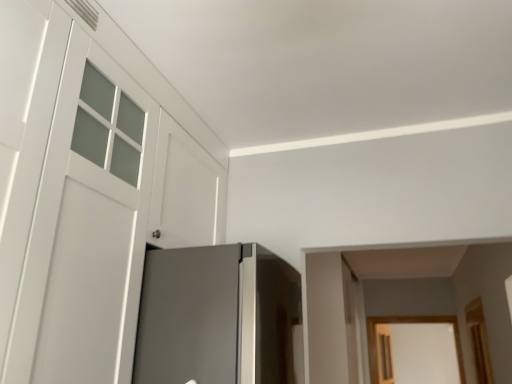
The image size is (512, 384). What do you see at coordinates (384, 354) in the screenshot?
I see `clear glass screen door at lower right` at bounding box center [384, 354].

Where is `clear glass screen door at lower right`? Image resolution: width=512 pixels, height=384 pixels. clear glass screen door at lower right is located at coordinates (384, 354).

What is the approximate height of clear glass screen door at lower right?

The height of clear glass screen door at lower right is 78.65 centimeters.

The image size is (512, 384). Describe the element at coordinates (89, 189) in the screenshot. I see `white matte door at left` at that location.

What are the coordinates of `white matte door at left` in the screenshot? It's located at (89, 189).

Where is `clear glass screen door at lower right`? The width and height of the screenshot is (512, 384). clear glass screen door at lower right is located at coordinates (384, 354).

Between clear glass screen door at lower right and white matte door at left, which one appears on the right side from the viewer's perspective?

Positioned to the right is clear glass screen door at lower right.

Is clear glass screen door at lower right in front of or behind white matte door at left in the image?

In the image, clear glass screen door at lower right appears behind white matte door at left.

Considering the positions of points (382, 366) and (66, 367), is point (382, 366) farther from camera compared to point (66, 367)?

Yes, point (382, 366) is farther from viewer.

From the image's perspective, does clear glass screen door at lower right appear lower than white matte door at left?

Yes, from the image's perspective, clear glass screen door at lower right is beneath white matte door at left.

Consider the image. From a real-world perspective, who is located lower, clear glass screen door at lower right or white matte door at left?

From a 3D spatial view, clear glass screen door at lower right is below.

Does clear glass screen door at lower right have a lesser width compared to white matte door at left?

Yes, clear glass screen door at lower right is thinner than white matte door at left.

In terms of height, does clear glass screen door at lower right look taller or shorter compared to white matte door at left?

clear glass screen door at lower right is shorter than white matte door at left.

Considering the relative sizes of clear glass screen door at lower right and white matte door at left in the image provided, is clear glass screen door at lower right bigger than white matte door at left?

Actually, clear glass screen door at lower right might be smaller than white matte door at left.

Is clear glass screen door at lower right inside the boundaries of white matte door at left, or outside?

The correct answer is: outside.

Is clear glass screen door at lower right beside white matte door at left?

clear glass screen door at lower right and white matte door at left are not in contact.

Does clear glass screen door at lower right turn towards white matte door at left?

No, clear glass screen door at lower right is not oriented towards white matte door at left.

Measure the distance between clear glass screen door at lower right and white matte door at left.

clear glass screen door at lower right and white matte door at left are 16.74 feet apart.

I want to click on screen door lying below the white matte door at left (from the image's perspective), so click(x=384, y=354).

Is white matte door at left at the right side of clear glass screen door at lower right?

No.

Does white matte door at left lie behind clear glass screen door at lower right?

No, white matte door at left is closer to the viewer.

Which is farther, (93, 370) or (386, 360)?

The point (386, 360) is farther from the camera.

From the image's perspective, which one is positioned lower, white matte door at left or clear glass screen door at lower right?

clear glass screen door at lower right is shown below in the image.

From a real-world perspective, who is located higher, white matte door at left or clear glass screen door at lower right?

From a 3D spatial view, white matte door at left is above.

Considering the sizes of white matte door at left and clear glass screen door at lower right in the image, is white matte door at left wider or thinner than clear glass screen door at lower right?

Clearly, white matte door at left has more width compared to clear glass screen door at lower right.

Between white matte door at left and clear glass screen door at lower right, which one has less height?

Standing shorter between the two is clear glass screen door at lower right.

Looking at this image, does white matte door at left have a smaller size compared to clear glass screen door at lower right?

Incorrect, white matte door at left is not smaller in size than clear glass screen door at lower right.

Is white matte door at left not within clear glass screen door at lower right?

white matte door at left is positioned outside clear glass screen door at lower right.

Consider the image. Is the surface of white matte door at left in direct contact with clear glass screen door at lower right?

No, white matte door at left is not in contact with clear glass screen door at lower right.

Is white matte door at left aimed at clear glass screen door at lower right?

No, white matte door at left is not aimed at clear glass screen door at lower right.

How different are the orientations of white matte door at left and clear glass screen door at lower right in degrees?

The angular difference between white matte door at left and clear glass screen door at lower right is 9.02 degrees.

Where is `door in front of the clear glass screen door at lower right`? door in front of the clear glass screen door at lower right is located at coordinates (89, 189).

At what (x,y) coordinates should I click in order to perform the action: click on door above the clear glass screen door at lower right (from a real-world perspective). Please return your answer as a coordinate pair (x, y). Image resolution: width=512 pixels, height=384 pixels. Looking at the image, I should click on (89, 189).

The image size is (512, 384). I want to click on screen door on the right of white matte door at left, so click(x=384, y=354).